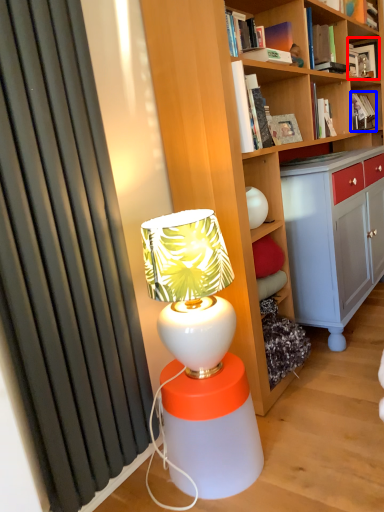
Question: Among these objects, which one is nearest to the camera, book (highlighted by a red box) or book (highlighted by a blue box)?

Choices:
 (A) book
 (B) book

Answer: (B)